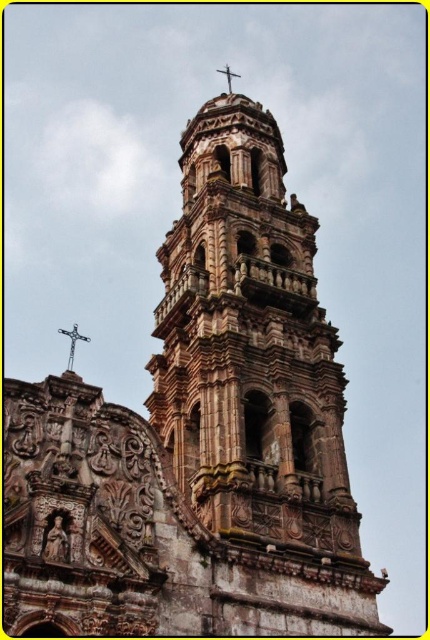
Which is more to the right, stone carved tower at center or silver metallic cross at upper center?

stone carved tower at center

Which of these two, stone carved tower at center or silver metallic cross at upper center, stands taller?

Standing taller between the two is stone carved tower at center.

Identify the location of stone carved tower at center. (248, 346).

Consider the image. Who is lower down, silver metallic cross at upper center or metallic cross at top-center?

Positioned lower is silver metallic cross at upper center.

Find the location of a particular element. The width and height of the screenshot is (430, 640). silver metallic cross at upper center is located at coordinates (73, 342).

Is point (86, 339) closer to camera compared to point (232, 76)?

That is True.

The image size is (430, 640). What are the coordinates of `silver metallic cross at upper center` in the screenshot? It's located at (73, 342).

Which is above, stone carved tower at center or metallic cross at top-center?

metallic cross at top-center

Measure the distance between stone carved tower at center and camera.

The distance of stone carved tower at center from camera is 47.06 meters.

Identify the location of stone carved tower at center. (248, 346).